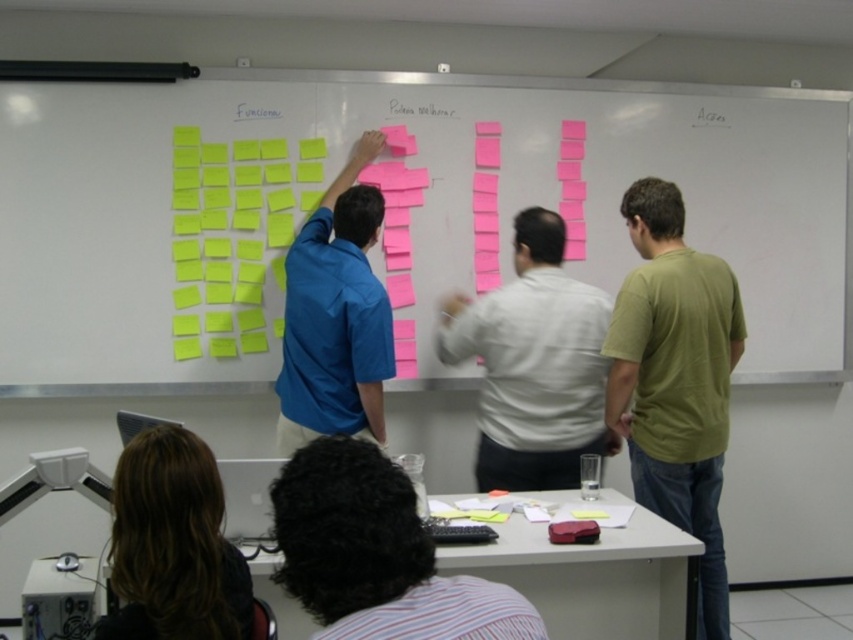
You are standing at the point closest to the camera in the scene. There are two points marked in the image, one at coordinates point (x=648, y=403) and another at point (x=192, y=477). Which of these points is farther away from your current position?

Point (x=648, y=403) is behind point (x=192, y=477), so it is farther away from your current position.